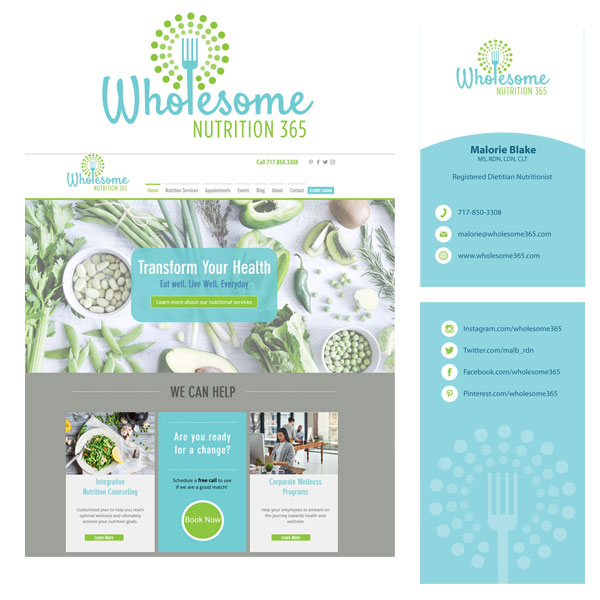
The height and width of the screenshot is (600, 600). I want to click on photographs, so click(304, 445), click(101, 455), click(307, 274).